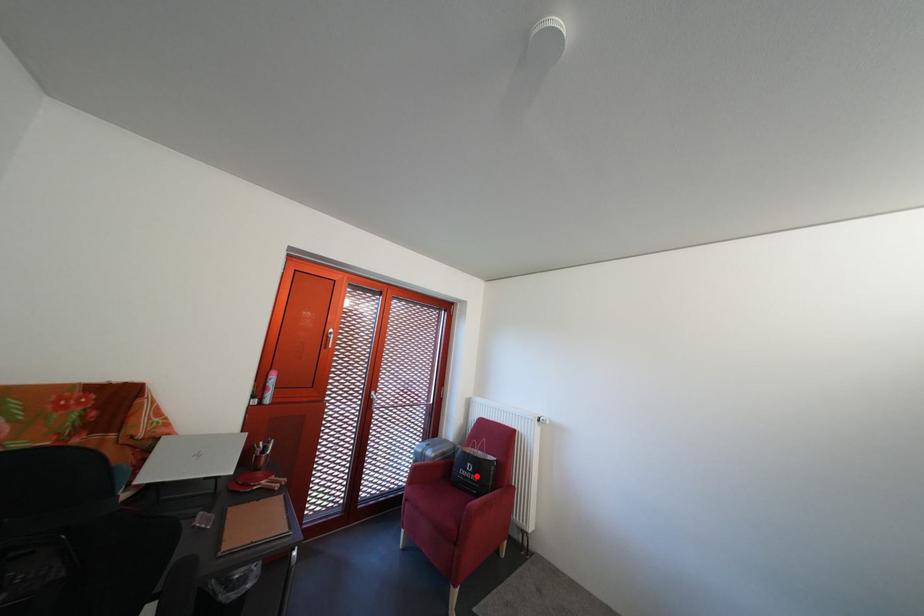
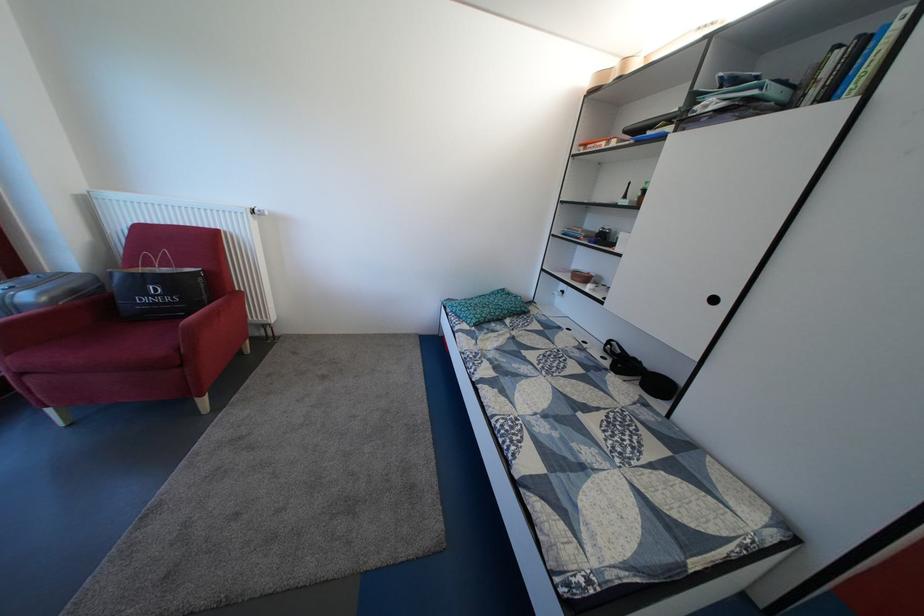
Where in the second image is the point corresponding to the highlighted location from the first image?

(159, 302)